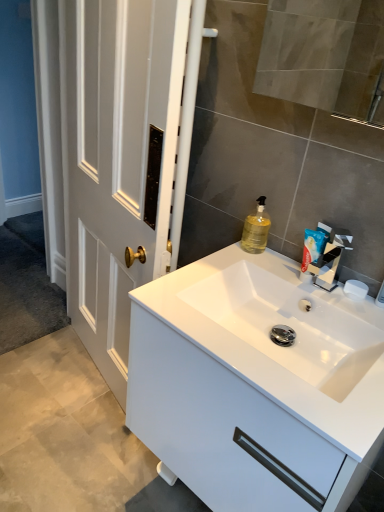
Locate an element on the screen. The image size is (384, 512). vacant space in between translucent yellow liquid at sink right and silver metallic tap at upper right is located at coordinates (276, 269).